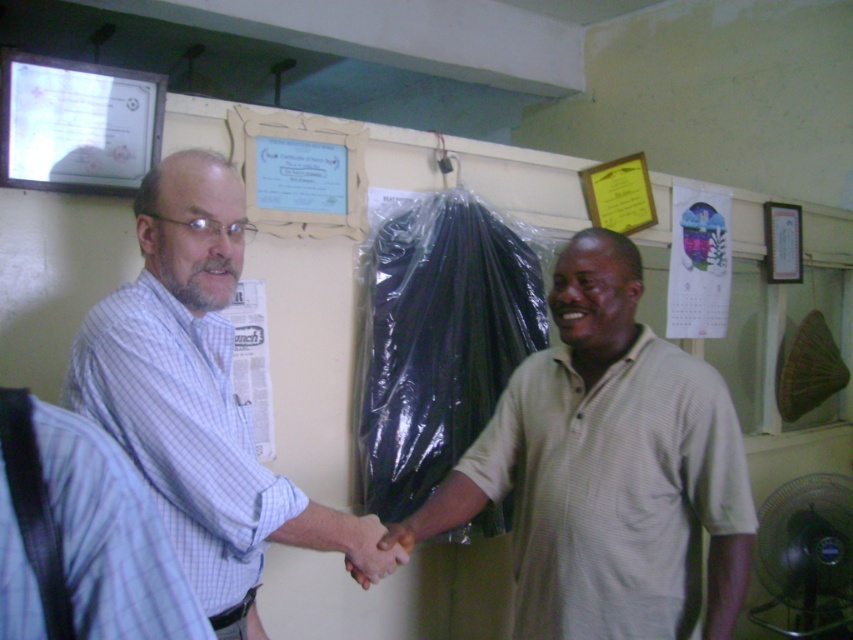
You are a photographer standing 10 feet away from the two people in the image. You want to take a photo of both the beige cotton shirt at center and the white striped shirt at center in the same frame. Given that your camera has a 50mm lens, which has a field of view that can capture a width of 36 inches at this distance, will both shirts fit within the camera frame?

The distance between the beige cotton shirt at center and the white striped shirt at center is 15.48 inches. Since the camera can capture a width of 36 inches at 10 feet, which is more than the 15.48 inches separating them, both shirts will fit within the camera frame.

What is the exact coordinate of the beige cotton shirt at center?

The beige cotton shirt at center is located at point (608, 468).